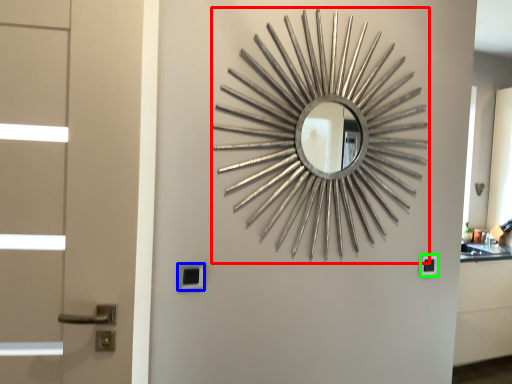
Question: Which object is positioned farthest from design (highlighted by a red box)? Select from lock (highlighted by a blue box) and lock (highlighted by a green box).

Choices:
 (A) lock
 (B) lock

Answer: (A)